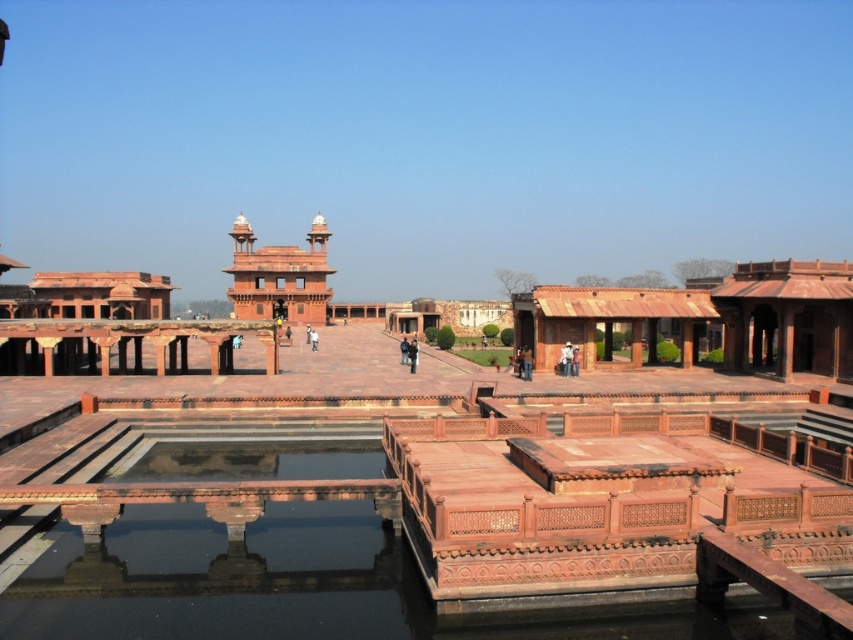
You are standing in the courtyard of the grand architectural complex. You see the smooth stone water at center and the terracotta stone palace at center. Which object is located lower in the scene?

The smooth stone water at center is located below the terracotta stone palace at center, so it is lower in the scene.

You are a tourist standing in front of the grand architectural complex. You see the smooth stone water at center and the terracotta stone palace at center. Which one takes up more space in the image?

The terracotta stone palace at center takes up more space than the smooth stone water at center because the smooth stone water at center occupies less space than the terracotta stone palace at center.